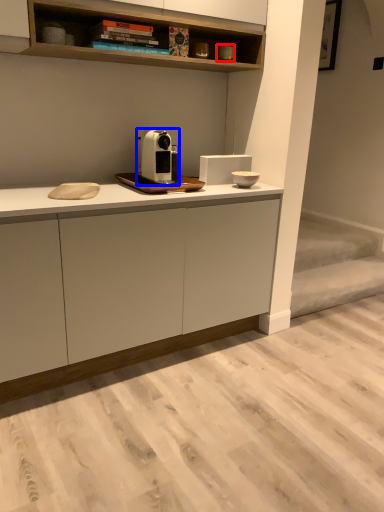
Question: Which object appears closest to the camera in this image, appliance (highlighted by a red box) or home appliance (highlighted by a blue box)?

Choices:
 (A) appliance
 (B) home appliance

Answer: (B)